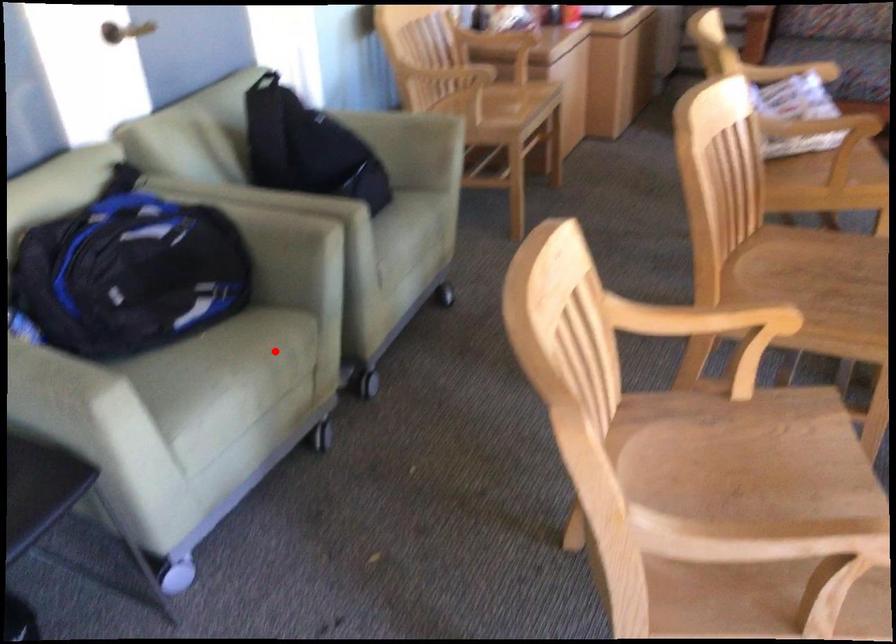
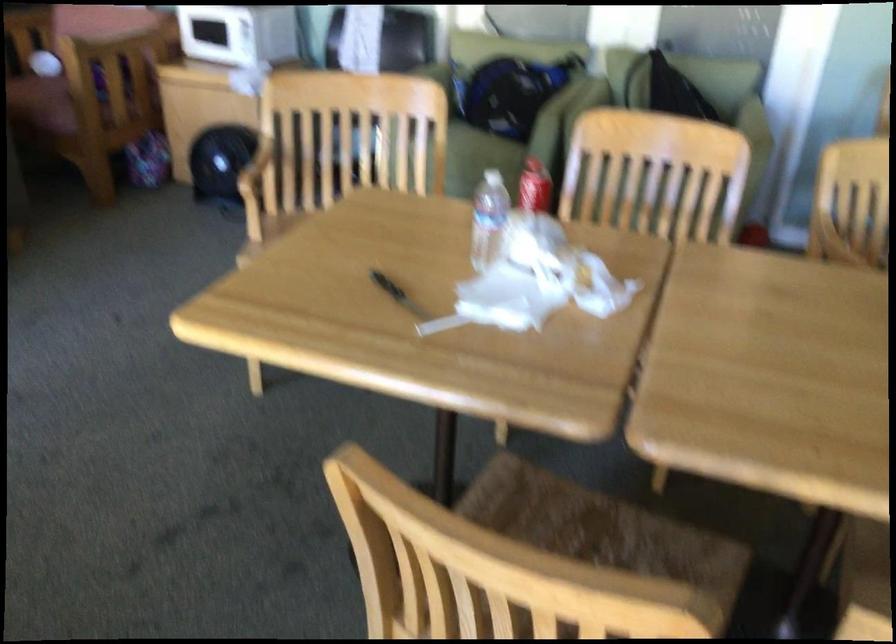
Locate, in the second image, the point that corresponds to the highlighted location in the first image.

(479, 160)